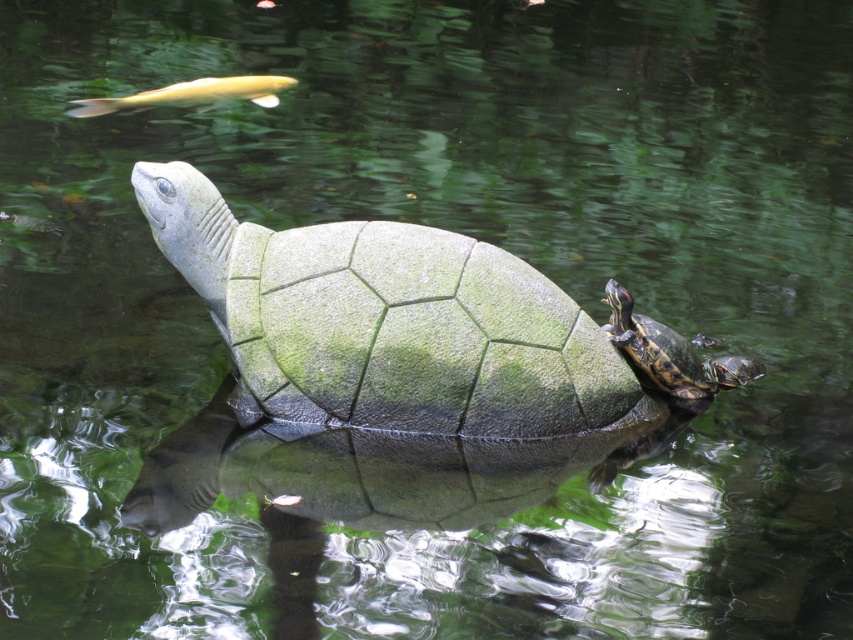
Is shiny brown tortoise at upper right smaller than golden smooth fish at upper left?

Indeed, shiny brown tortoise at upper right has a smaller size compared to golden smooth fish at upper left.

Can you confirm if shiny brown tortoise at upper right is taller than golden smooth fish at upper left?

Yes, shiny brown tortoise at upper right is taller than golden smooth fish at upper left.

Locate an element on the screen. shiny brown tortoise at upper right is located at coordinates (670, 355).

Who is positioned more to the left, green mossy tortoise at center or shiny brown tortoise at upper right?

green mossy tortoise at center

Is green mossy tortoise at center bigger than shiny brown tortoise at upper right?

Yes.

Measure the distance between green mossy tortoise at center and camera.

green mossy tortoise at center is 13.16 feet away from camera.

Where is `green mossy tortoise at center`? green mossy tortoise at center is located at coordinates (387, 323).

Between green mossy tortoise at center and golden smooth fish at upper left, which one appears on the right side from the viewer's perspective?

From the viewer's perspective, green mossy tortoise at center appears more on the right side.

Can you confirm if green mossy tortoise at center is wider than golden smooth fish at upper left?

Indeed, green mossy tortoise at center has a greater width compared to golden smooth fish at upper left.

Who is more distant from viewer, (247, 392) or (171, 102)?

The point (171, 102) is more distant.

The width and height of the screenshot is (853, 640). Identify the location of green mossy tortoise at center. (387, 323).